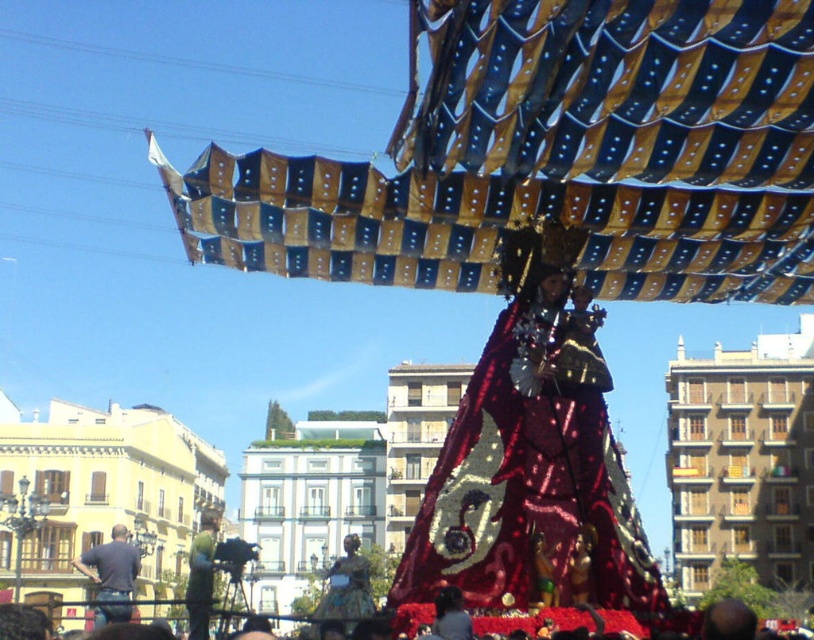
Question: Can you confirm if shiny red fabric at center is positioned to the right of green fabric costume at center?

Choices:
 (A) yes
 (B) no

Answer: (A)

Question: Among these objects, which one is farthest from the camera?

Choices:
 (A) matte gold fabric at center
 (B) green fabric costume at center
 (C) shiny red fabric at center
 (D) dark blue jeans at lower left

Answer: (B)

Question: Among these points, which one is farthest from the camera?

Choices:
 (A) (199, 531)
 (B) (79, 564)
 (C) (458, 444)

Answer: (A)

Question: Is shiny red fabric at center further to camera compared to green fabric costume at center?

Choices:
 (A) yes
 (B) no

Answer: (B)

Question: Which object appears closest to the camera in this image?

Choices:
 (A) dark blue jeans at lower left
 (B) shiny red fabric at center
 (C) green fabric costume at center

Answer: (B)

Question: Is dark blue jeans at lower left positioned behind matte gold fabric at center?

Choices:
 (A) no
 (B) yes

Answer: (B)